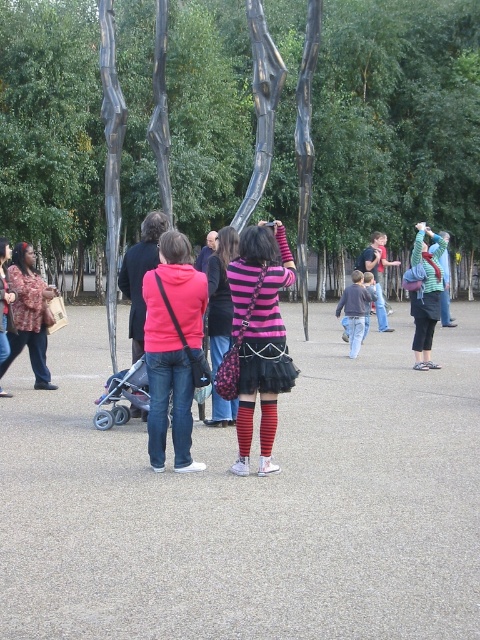
Question: Observing the image, what is the correct spatial positioning of printed fabric shirt at left in reference to striped knit sweater at center?

Choices:
 (A) right
 (B) left

Answer: (B)

Question: In this image, where is pink striped sweater at center located relative to printed fabric shirt at left?

Choices:
 (A) above
 (B) below

Answer: (B)

Question: Is printed fabric shirt at left positioned before gray plastic baby carriage at lower left?

Choices:
 (A) no
 (B) yes

Answer: (A)

Question: Estimate the real-world distances between objects in this image. Which object is farther from the striped knit sweater at center?

Choices:
 (A) gray plastic baby carriage at lower left
 (B) pink striped sweater at center
 (C) pink fleece jacket at center
 (D) printed fabric shirt at left

Answer: (D)

Question: Considering the real-world distances, which object is closest to the striped knit sweater at center?

Choices:
 (A) printed fabric shirt at left
 (B) pink striped sweater at center

Answer: (B)

Question: Which point appears farthest from the camera in this image?

Choices:
 (A) pyautogui.click(x=203, y=314)
 (B) pyautogui.click(x=121, y=385)

Answer: (B)